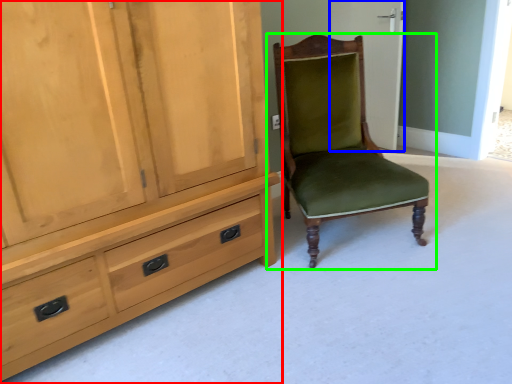
Question: Estimate the real-world distances between objects in this image. Which object is farther from cabinetry (highlighted by a red box), screen door (highlighted by a blue box) or chair (highlighted by a green box)?

Choices:
 (A) screen door
 (B) chair

Answer: (A)